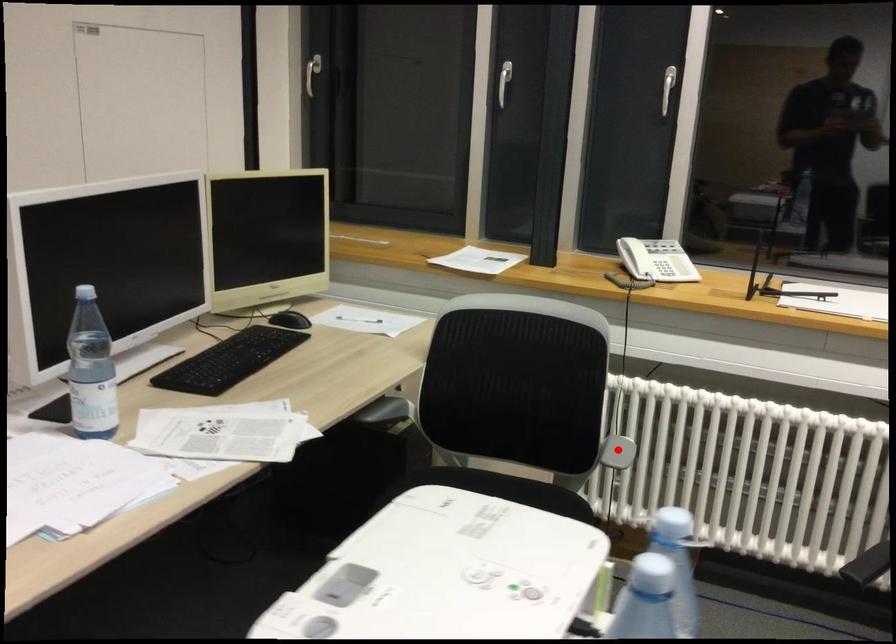
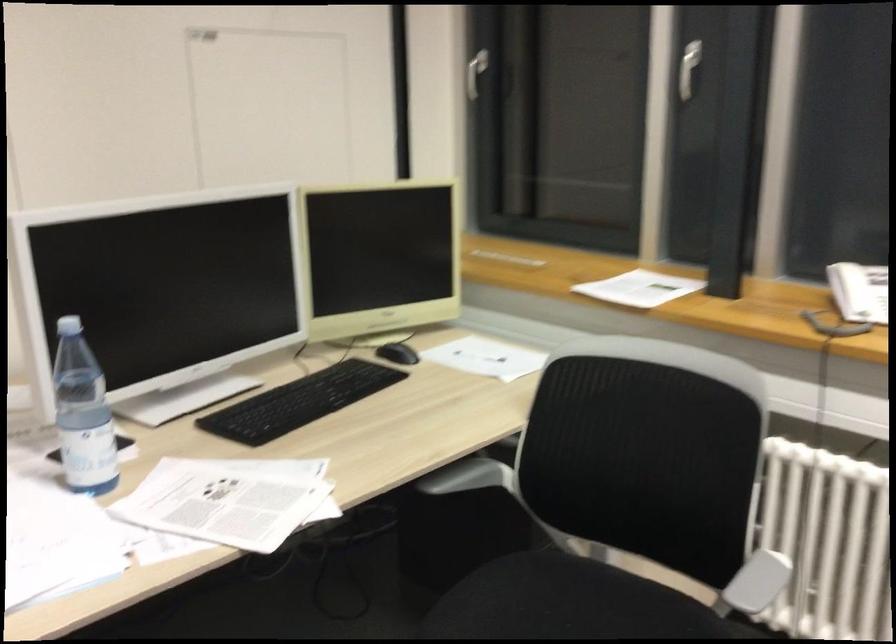
Question: A red point is marked in image1. In image2, is the corresponding 3D point closer to the camera or farther? Reply with the corresponding letter.

Choices:
 (A) The corresponding 3D point is closer.
 (B) The corresponding 3D point is farther.

Answer: (A)